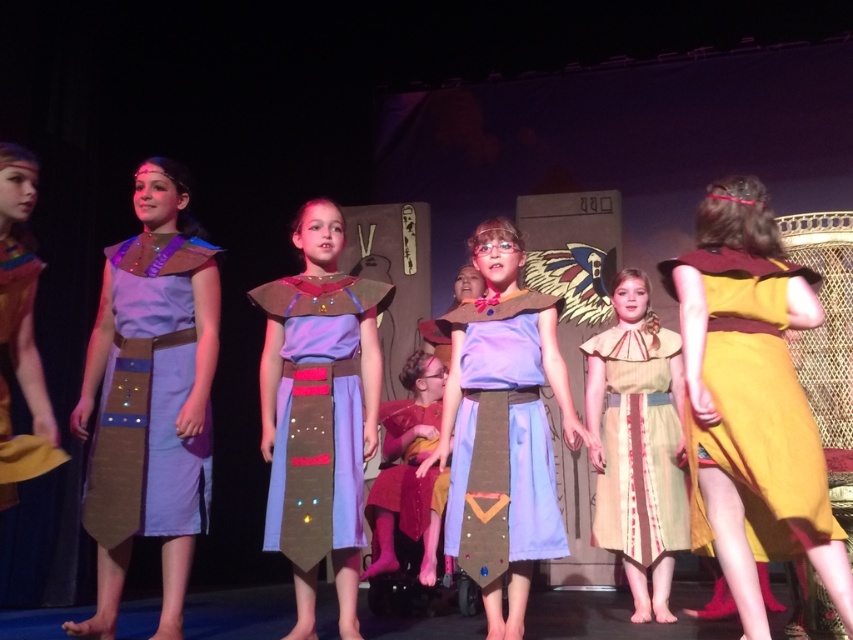
You are a costume designer reviewing the stage setup. You notice the beige fabric dress at center and the velvet maroon dress at center. Which dress has a wider silhouette?

The beige fabric dress at center has a wider silhouette than the velvet maroon dress at center.

In the image of the children performing on stage, which dress is positioned to the right of the other between the matte blue fabric dress at center and the light purple fabric dress at center?

The matte blue fabric dress at center is positioned to the right of the light purple fabric dress at center.